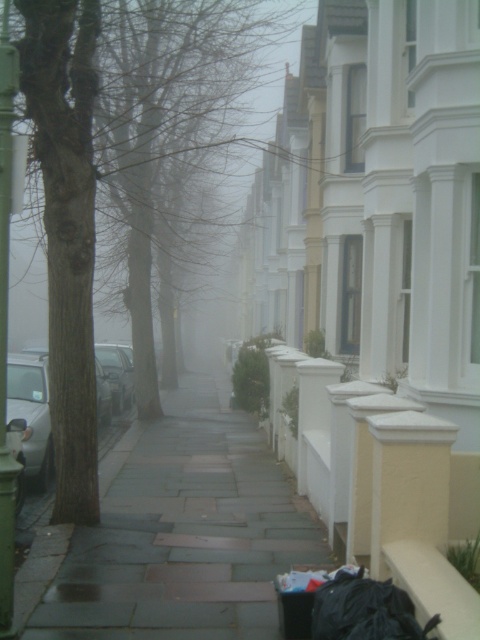
Which of these two, dark gray stone pavement at center or brown rough tree at left, stands taller?

brown rough tree at left is taller.

Is dark gray stone pavement at center positioned at the back of brown rough tree at left?

Yes.

Between point (266, 470) and point (80, 168), which one is positioned in front?

Positioned in front is point (80, 168).

You are a GUI agent. You are given a task and a screenshot of the screen. Output one action in this format:
    pyautogui.click(x=<x>, y=<y>)
    Task: Click on the dark gray stone pavement at center
    The height and width of the screenshot is (640, 480).
    Given the screenshot: What is the action you would take?
    pyautogui.click(x=183, y=531)